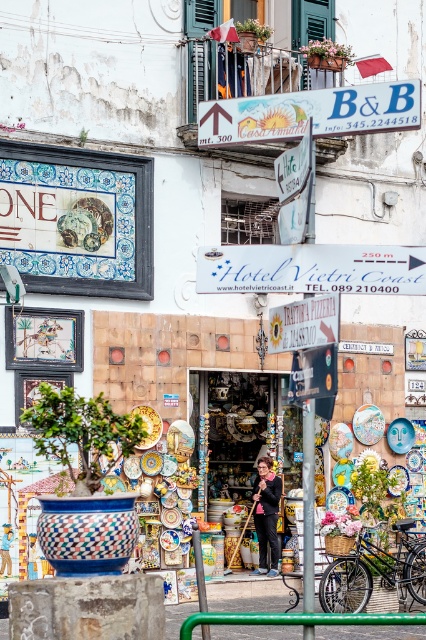
You are a tourist in this Mediterranean town and see both the white plastic sign at center and the white glossy signboard at center. According to their positions, which one should you look at first if you want to read both signs starting from the left side?

You should look at the white plastic sign at center first because it is to the left of the white glossy signboard at center.

Looking at this image, you are a tourist standing on the street looking at the shop with the colorful ceramics. You see a white plastic sign at upper center. Where exactly is the white plastic sign located in relation to the shop and the balcony?

The white plastic sign at upper center is located at point coordinates (310, 113), which places it above the shop but below the balcony.

You are a tourist who just arrived at this vibrant street scene. You see a white plastic sign at center and a white glossy signboard at center. Which one is positioned higher?

The white plastic sign at center is located above the white glossy signboard at center, so it is positioned higher.